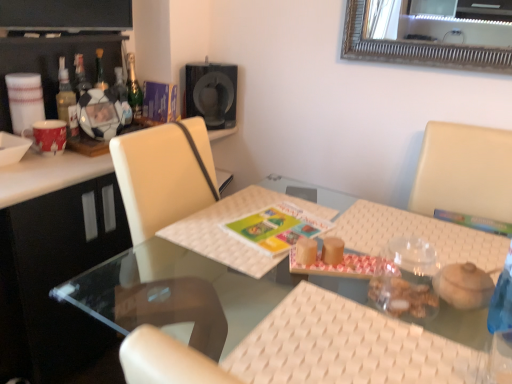
What are the coordinates of `free space underneath white woven placemat at right, arranged as the second place mat when viewed from the left (from a real-world perspective)` in the screenshot? It's located at (403, 244).